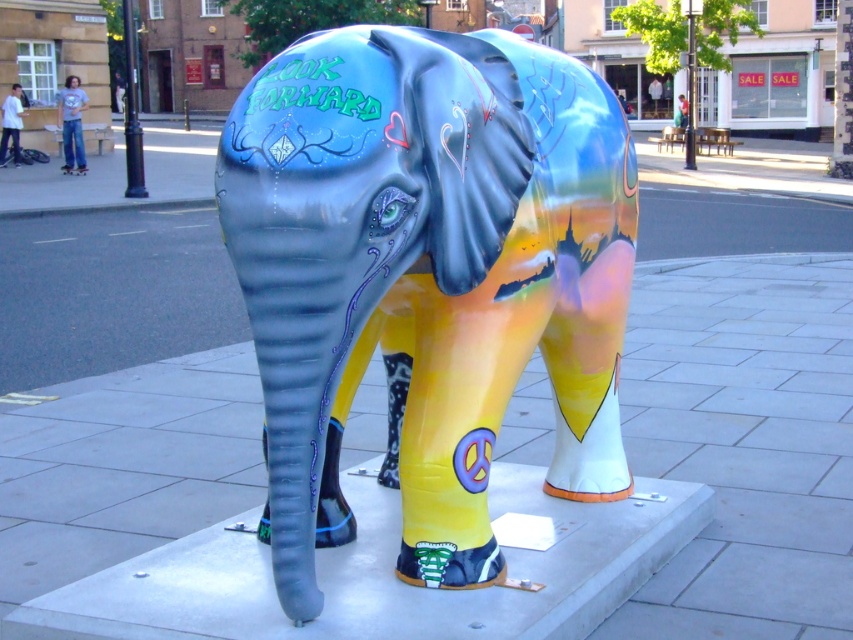
Question: Is shiny metallic elephant at center positioned at the back of smooth concrete elephant at center?

Choices:
 (A) no
 (B) yes

Answer: (A)

Question: Which point is closer to the camera taking this photo?

Choices:
 (A) (631, 442)
 (B) (310, 157)

Answer: (B)

Question: Is the position of shiny metallic elephant at center less distant than that of smooth concrete elephant at center?

Choices:
 (A) yes
 (B) no

Answer: (A)

Question: Among these points, which one is farthest from the camera?

Choices:
 (A) (38, 528)
 (B) (222, 156)

Answer: (A)

Question: Can you confirm if shiny metallic elephant at center is wider than smooth concrete elephant at center?

Choices:
 (A) no
 (B) yes

Answer: (A)